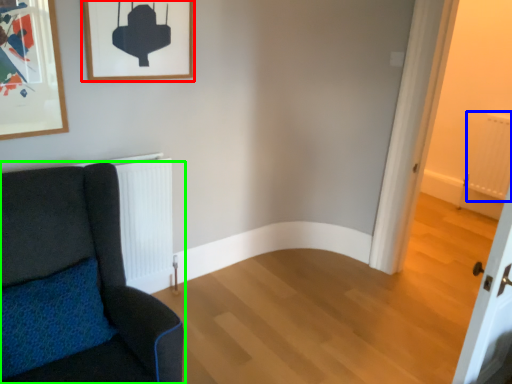
Question: Estimate the real-world distances between objects in this image. Which object is closer to picture frame (highlighted by a red box), radiator (highlighted by a blue box) or chair (highlighted by a green box)?

Choices:
 (A) radiator
 (B) chair

Answer: (B)